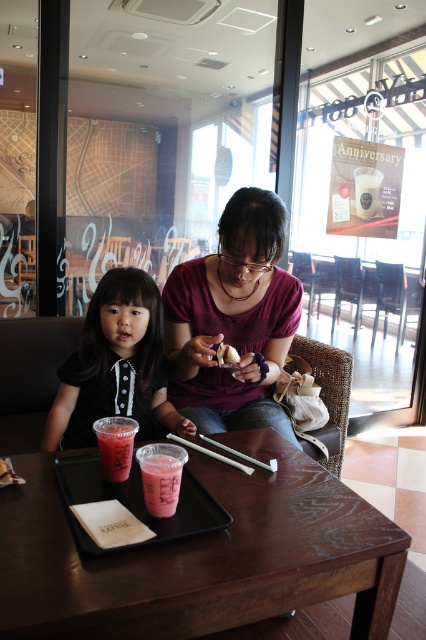
Question: Is black matte shirt at left wider than metallic silver chopsticks at center?

Choices:
 (A) yes
 (B) no

Answer: (A)

Question: Which of the following is the farthest from the observer?

Choices:
 (A) (232, 451)
 (B) (94, 426)
 (C) (201, 449)

Answer: (A)

Question: Considering the relative positions of translucent plastic cup at lower left and matte plastic cup at upper right in the image provided, where is translucent plastic cup at lower left located with respect to matte plastic cup at upper right?

Choices:
 (A) above
 (B) below

Answer: (B)

Question: Does pink matte plastic cup at lower center have a lesser width compared to white glossy donut at center?

Choices:
 (A) no
 (B) yes

Answer: (A)

Question: Which object appears closest to the camera in this image?

Choices:
 (A) matte plastic cup at upper right
 (B) black matte shirt at left
 (C) matte purple shirt at center
 (D) metallic silver chopsticks at center

Answer: (D)

Question: Estimate the real-world distances between objects in this image. Which object is closer to the matte plastic cup at upper right?

Choices:
 (A) translucent plastic cup at lower left
 (B) white glossy donut at center
 (C) green matte chopsticks at center

Answer: (B)